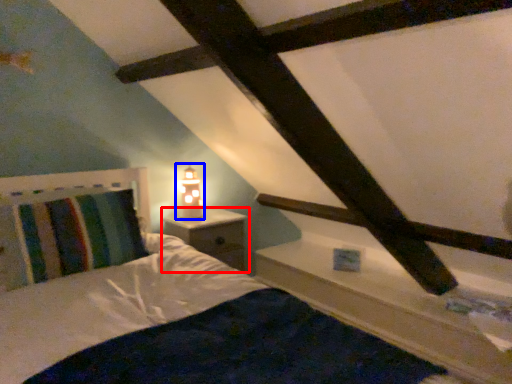
Question: Which point is closer to the camera, nightstand (highlighted by a red box) or table lamp (highlighted by a blue box)?

Choices:
 (A) nightstand
 (B) table lamp

Answer: (A)